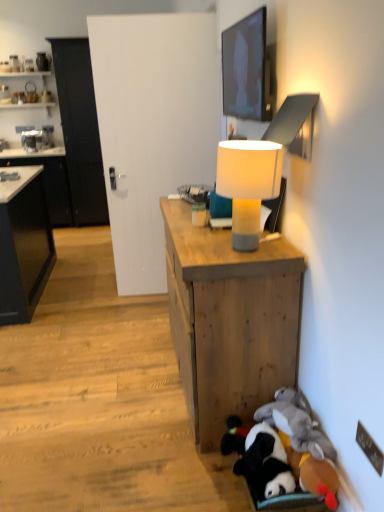
Question: Is matte black tv at upper center further to camera compared to black matte cabinet at left, the 2th cabinetry positioned from the right?

Choices:
 (A) yes
 (B) no

Answer: (B)

Question: Would you say black matte cabinet at left, the 2th cabinetry positioned from the right, is part of matte black tv at upper center's contents?

Choices:
 (A) yes
 (B) no

Answer: (B)

Question: Is matte black tv at upper center positioned before black matte cabinet at left, the 2th cabinetry positioned from the right?

Choices:
 (A) yes
 (B) no

Answer: (A)

Question: Is matte black tv at upper center shorter than black matte cabinet at left, the 2th cabinetry positioned from the right?

Choices:
 (A) yes
 (B) no

Answer: (A)

Question: Is matte black tv at upper center to the left of black matte cabinet at left, marked as the 1th cabinetry in a left-to-right arrangement, from the viewer's perspective?

Choices:
 (A) no
 (B) yes

Answer: (A)

Question: Is black glossy cabinet at left, the 2th cabinetry from the left, taller or shorter than wooden desk at center?

Choices:
 (A) short
 (B) tall

Answer: (B)

Question: Is point (84, 132) closer or farther from the camera than point (269, 250)?

Choices:
 (A) farther
 (B) closer

Answer: (A)

Question: Based on their positions, is black glossy cabinet at left, the 2th cabinetry from the left, located to the left or right of wooden desk at center?

Choices:
 (A) right
 (B) left

Answer: (B)

Question: From a real-world perspective, relative to wooden desk at center, is black glossy cabinet at left, the 2th cabinetry from the left, vertically above or below?

Choices:
 (A) below
 (B) above

Answer: (B)

Question: In the image, is white fabric lampshade at center on the left side or the right side of wooden desk at center?

Choices:
 (A) left
 (B) right

Answer: (B)

Question: Considering their positions, is white fabric lampshade at center located in front of or behind wooden desk at center?

Choices:
 (A) front
 (B) behind

Answer: (A)

Question: Is white fabric lampshade at center inside the boundaries of wooden desk at center, or outside?

Choices:
 (A) inside
 (B) outside

Answer: (B)

Question: Is point (258, 175) closer or farther from the camera than point (188, 279)?

Choices:
 (A) closer
 (B) farther

Answer: (A)

Question: Considering their positions, is black glossy cabinet at left, positioned as the 1th cabinetry in right-to-left order, located in front of or behind fluffy plush toys at lower right?

Choices:
 (A) front
 (B) behind

Answer: (B)

Question: Is black glossy cabinet at left, positioned as the 1th cabinetry in right-to-left order, taller or shorter than fluffy plush toys at lower right?

Choices:
 (A) tall
 (B) short

Answer: (A)